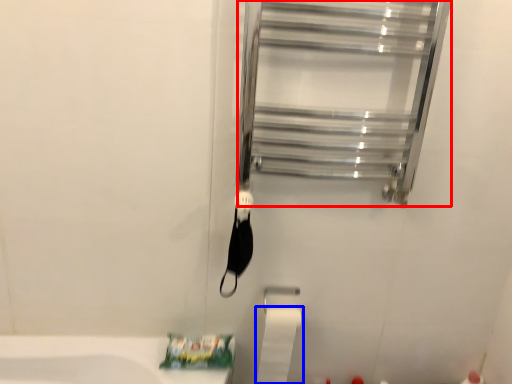
Question: Among these objects, which one is farthest to the camera, glass door (highlighted by a red box) or toilet paper (highlighted by a blue box)?

Choices:
 (A) glass door
 (B) toilet paper

Answer: (B)